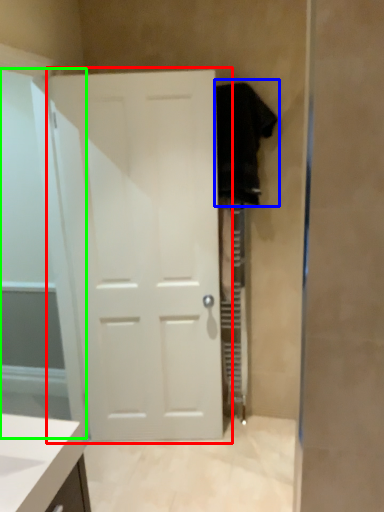
Question: Based on their relative distances, which object is farther from door (highlighted by a red box)? Choose from robe (highlighted by a blue box) and glass door (highlighted by a green box).

Choices:
 (A) robe
 (B) glass door

Answer: (A)